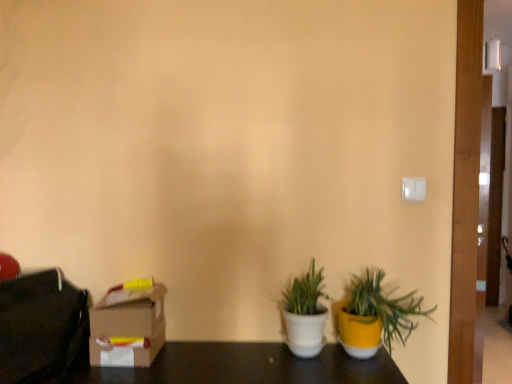
Question: Is cardboard box at lower left thinner than yellow matte pot at lower right, the second houseplant in the left-to-right sequence?

Choices:
 (A) no
 (B) yes

Answer: (B)

Question: Does cardboard box at lower left have a larger size compared to yellow matte pot at lower right, which is the 1th houseplant in right-to-left order?

Choices:
 (A) no
 (B) yes

Answer: (A)

Question: From the image's perspective, is cardboard box at lower left over yellow matte pot at lower right, which is the 1th houseplant in right-to-left order?

Choices:
 (A) no
 (B) yes

Answer: (A)

Question: Does cardboard box at lower left appear on the left side of yellow matte pot at lower right, the second houseplant in the left-to-right sequence?

Choices:
 (A) yes
 (B) no

Answer: (A)

Question: From a real-world perspective, is cardboard box at lower left located beneath yellow matte pot at lower right, which is the 1th houseplant in right-to-left order?

Choices:
 (A) yes
 (B) no

Answer: (A)

Question: Is cardboard box at lower left to the right of yellow matte pot at lower right, the second houseplant in the left-to-right sequence, from the viewer's perspective?

Choices:
 (A) yes
 (B) no

Answer: (B)

Question: From a real-world perspective, is yellow matte pot at lower right, which is the 1th houseplant in right-to-left order, over white matte pot at center, the second houseplant viewed from the right?

Choices:
 (A) yes
 (B) no

Answer: (A)

Question: Would you say yellow matte pot at lower right, which is the 1th houseplant in right-to-left order, contains white matte pot at center, the second houseplant viewed from the right?

Choices:
 (A) no
 (B) yes

Answer: (A)

Question: From a real-world perspective, is yellow matte pot at lower right, the second houseplant in the left-to-right sequence, located beneath white matte pot at center, which ranks as the first houseplant in left-to-right order?

Choices:
 (A) no
 (B) yes

Answer: (A)

Question: Is yellow matte pot at lower right, the second houseplant in the left-to-right sequence, not within white matte pot at center, the second houseplant viewed from the right?

Choices:
 (A) yes
 (B) no

Answer: (A)

Question: Can you confirm if yellow matte pot at lower right, the second houseplant in the left-to-right sequence, is wider than white matte pot at center, the second houseplant viewed from the right?

Choices:
 (A) no
 (B) yes

Answer: (B)

Question: Is the position of yellow matte pot at lower right, the second houseplant in the left-to-right sequence, more distant than that of white matte pot at center, the second houseplant viewed from the right?

Choices:
 (A) yes
 (B) no

Answer: (B)

Question: Is white matte pot at center, which ranks as the first houseplant in left-to-right order, turned away from yellow matte pot at lower right, which is the 1th houseplant in right-to-left order?

Choices:
 (A) no
 (B) yes

Answer: (A)